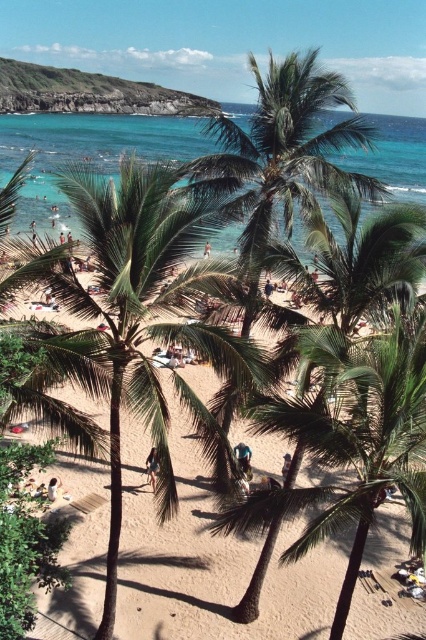
You are a drone operator trying to capture a photo of the light brown sandy beach at center. The drone is currently at coordinates point A. To ensure the beach is in the center of the photo, should you move the drone to the left or right? Please provide your answer based on the coordinates provided in the description.

The light brown sandy beach at center is located at point 0.872 on the x axis. Since the beach is already at the center of the image, the drone does not need to move left or right to capture it in the center of the photo.

You are a photographer positioned on the beach and want to capture a photo that includes both the clear blue water at upper center and the light brown leather surfboard at center. Based on their positions, which object should you adjust your camera angle to focus on first to ensure both are in frame?

The clear blue water at upper center is located above the light brown leather surfboard at center, so you should adjust your camera angle to focus on the clear blue water at upper center first to ensure both are in frame.